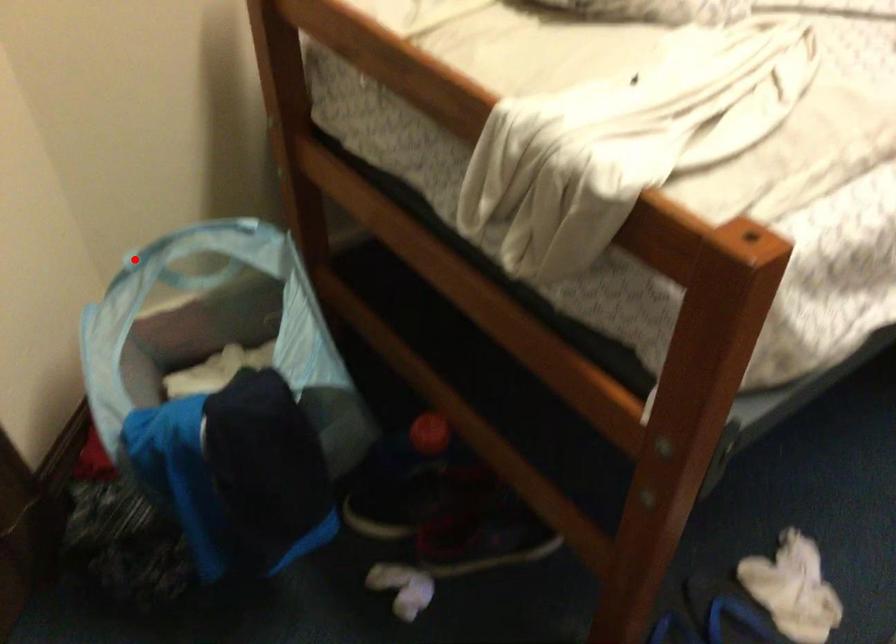
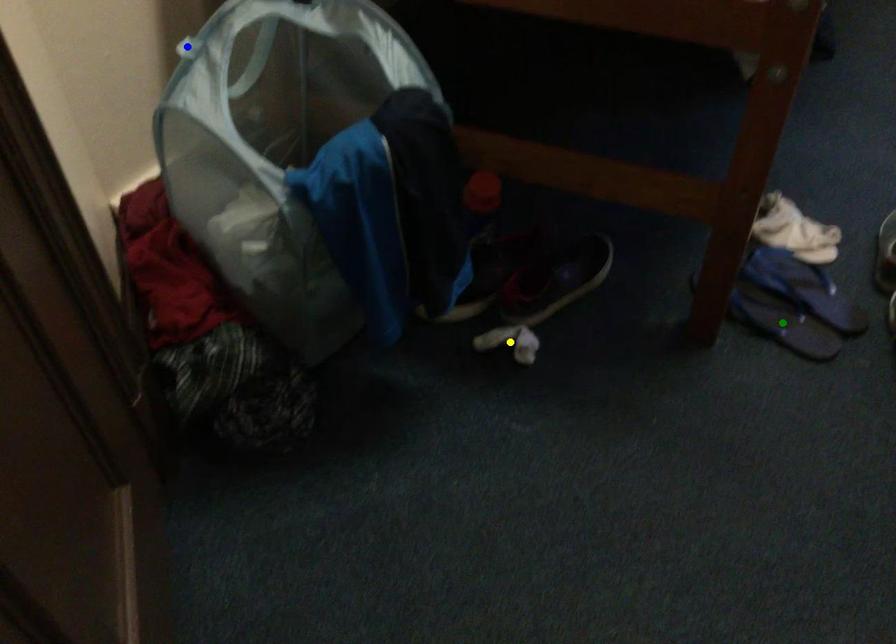
Question: I am providing you with two images of the same scene from different viewpoints. A red point is marked on the first image. You are given multiple points on the second image. Which point in image 2 represents the same 3d spot as the red point in image 1?

Choices:
 (A) green point
 (B) blue point
 (C) yellow point

Answer: (B)